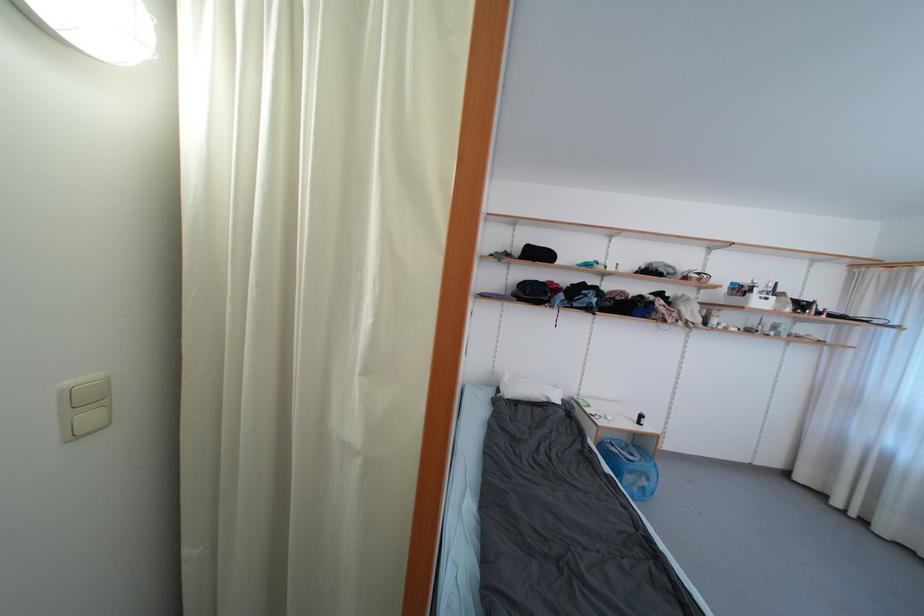
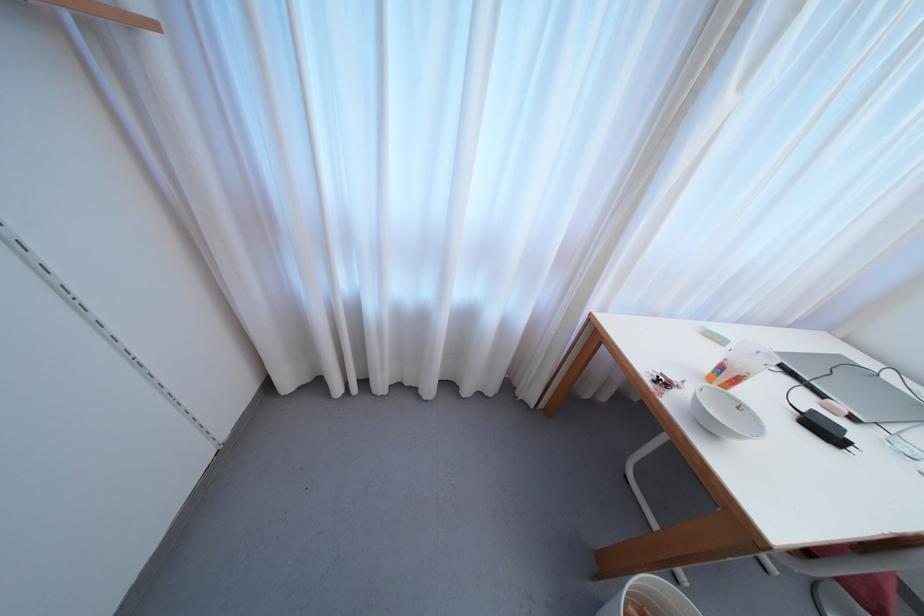
Where in the second image is the point corresponding to pixel 840 506 from the first image?

(342, 392)